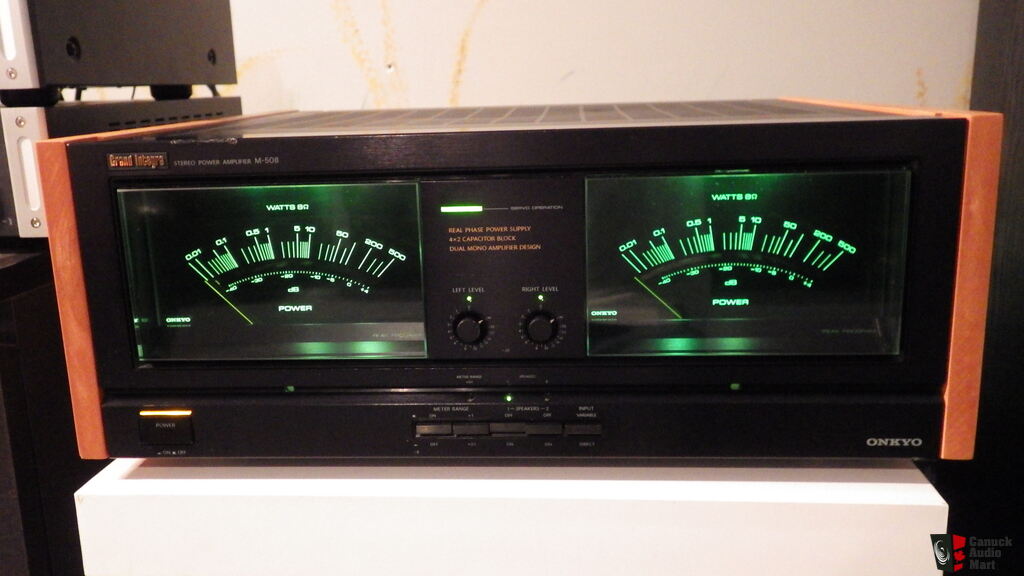
Locate an element on the screen. white wall is located at coordinates coord(356,43), coord(791,44).